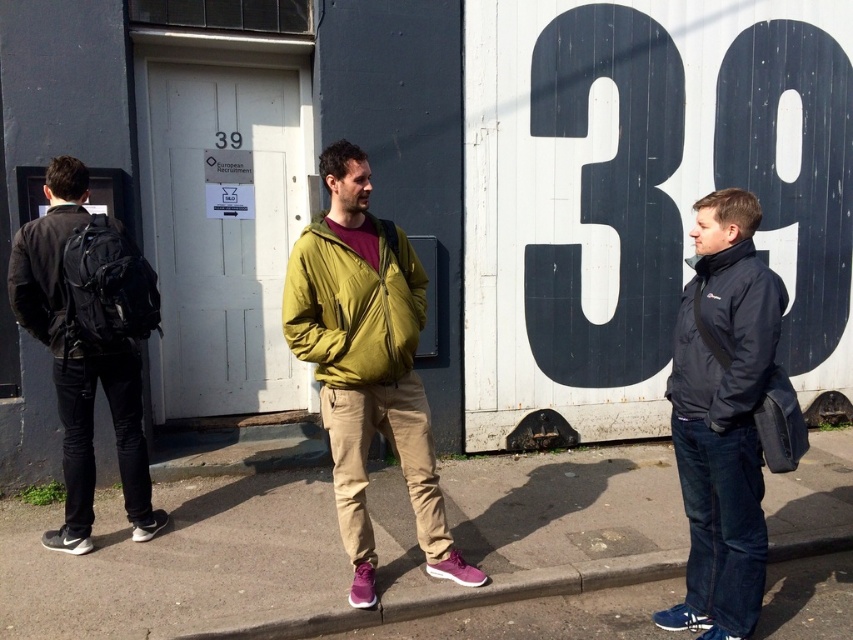
You are a delivery person carrying a heavy box. You see the black matte jacket at right and the concrete at lower center. Which object can you place the box on without worrying about it breaking?

The concrete at lower center is thicker than the black matte jacket at right, so you can place the box on the concrete at lower center without worrying about it breaking.

You are standing in front of the building labeled 39 and need to determine the distance between two points marked on the wall. The points are point 1 at coordinates (419, 312) and point 2 at coordinates (676, 563). Given that point 1 is closer to you than point 2, can you estimate which point is nearer to the entrance door?

Point 1 at coordinates (419, 312) is closer to the entrance door because it is nearer to the camera compared to point 2 at coordinates (676, 563).